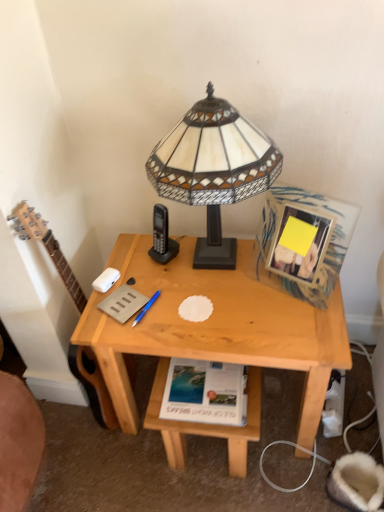
Question: Based on their sizes in the image, would you say natural wood table at lower center is bigger or smaller than wooden picture frame at upper right?

Choices:
 (A) small
 (B) big

Answer: (B)

Question: Looking at their shapes, would you say natural wood table at lower center is wider or thinner than wooden picture frame at upper right?

Choices:
 (A) wide
 (B) thin

Answer: (A)

Question: Estimate the real-world distances between objects in this image. Which object is closer to the stained glass lampshade at center?

Choices:
 (A) white paper at lower center, the first paperback book positioned from the bottom
 (B) natural wood table at lower center
 (C) wooden acoustic guitar at left
 (D) matte gray paperback book at center, marked as the 1th paperback book in a left-to-right arrangement
 (E) wooden picture frame at upper right

Answer: (E)

Question: Estimate the real-world distances between objects in this image. Which object is farther from the stained glass lampshade at center?

Choices:
 (A) white paper at lower center, the first paperback book positioned from the bottom
 (B) wooden acoustic guitar at left
 (C) wooden picture frame at upper right
 (D) natural wood table at lower center
 (E) light wood desk at center

Answer: (D)